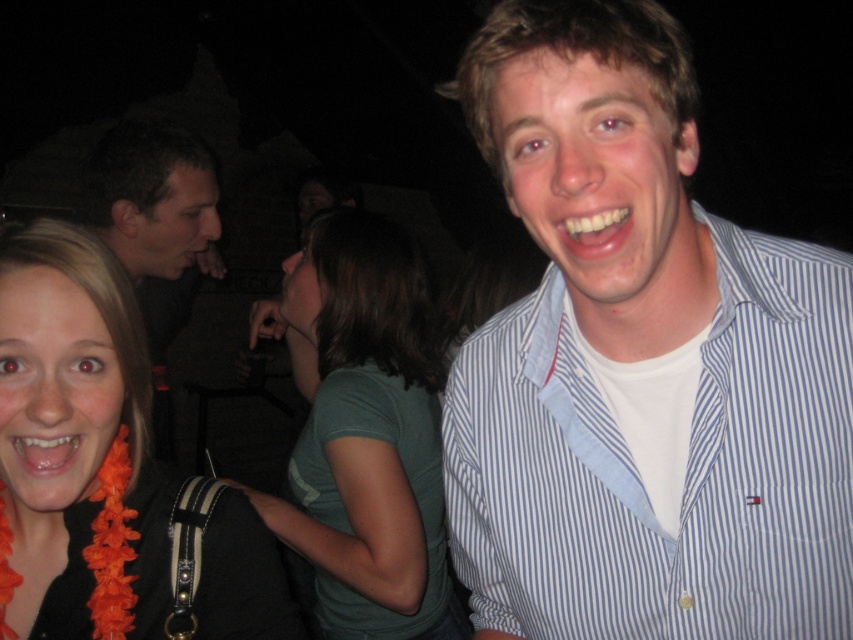
You are a photographer at the party and want to take a group photo. The camera has a limited frame width. The green matte shirt at center and dark brown hair at upper left are both in the shot. Which object takes up more horizontal space in the photo?

The green matte shirt at center takes up more horizontal space in the photo because its width surpasses that of the dark brown hair at upper left.

You are at a party and want to find the tallest person between the white striped shirt at upper right and the dark brown hair at upper left. Which one should you approach?

The dark brown hair at upper left is taller than the white striped shirt at upper right, so you should approach the dark brown hair at upper left.